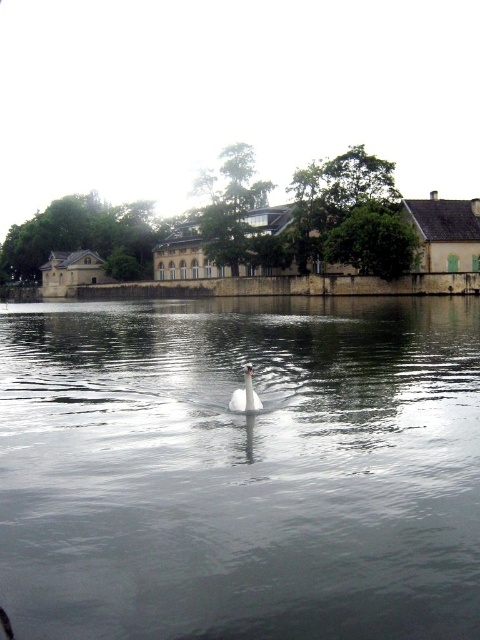
Question: In this image, where is clear water at center located relative to white glossy swan at center?

Choices:
 (A) below
 (B) above

Answer: (B)

Question: Which point is farther to the camera?

Choices:
 (A) clear water at center
 (B) white glossy swan at center

Answer: (B)

Question: Which object is farther from the camera taking this photo?

Choices:
 (A) clear water at center
 (B) white glossy swan at center

Answer: (B)

Question: Can you confirm if clear water at center is positioned above white glossy swan at center?

Choices:
 (A) no
 (B) yes

Answer: (B)

Question: Does clear water at center lie behind white glossy swan at center?

Choices:
 (A) yes
 (B) no

Answer: (B)